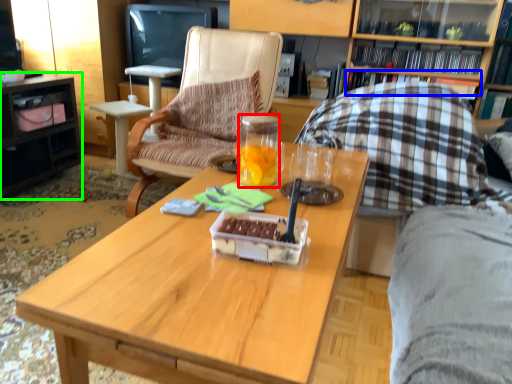
Question: Which object is the farthest from coffee cup (highlighted by a red box)? Choose among these: book (highlighted by a blue box) or desk (highlighted by a green box).

Choices:
 (A) book
 (B) desk

Answer: (B)